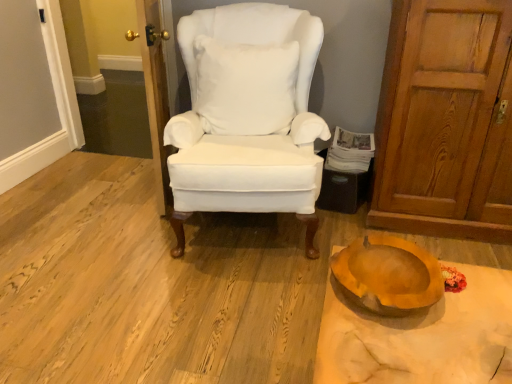
Question: Would you say matte orange bowl at lower right is outside white fabric chair at center?

Choices:
 (A) yes
 (B) no

Answer: (A)

Question: Can you see matte orange bowl at lower right touching white fabric chair at center?

Choices:
 (A) no
 (B) yes

Answer: (A)

Question: Does matte orange bowl at lower right have a greater width compared to white fabric chair at center?

Choices:
 (A) no
 (B) yes

Answer: (A)

Question: Is white fabric chair at center at the back of matte orange bowl at lower right?

Choices:
 (A) yes
 (B) no

Answer: (B)

Question: Considering the relative sizes of matte orange bowl at lower right and white fabric chair at center in the image provided, is matte orange bowl at lower right taller than white fabric chair at center?

Choices:
 (A) no
 (B) yes

Answer: (A)

Question: Can you confirm if matte orange bowl at lower right is smaller than white fabric chair at center?

Choices:
 (A) no
 (B) yes

Answer: (B)

Question: From a real-world perspective, is wooden bowl at lower right below wooden door at right, the second door positioned from the left?

Choices:
 (A) no
 (B) yes

Answer: (B)

Question: Is wooden bowl at lower right not within wooden door at right, the second door positioned from the left?

Choices:
 (A) yes
 (B) no

Answer: (A)

Question: Is wooden bowl at lower right to the left of wooden door at right, the second door positioned from the left, from the viewer's perspective?

Choices:
 (A) yes
 (B) no

Answer: (A)

Question: Is there a large distance between wooden bowl at lower right and wooden door at right, arranged as the first door when viewed from the right?

Choices:
 (A) no
 (B) yes

Answer: (B)

Question: Is wooden bowl at lower right further to the viewer compared to wooden door at right, arranged as the first door when viewed from the right?

Choices:
 (A) yes
 (B) no

Answer: (B)

Question: Can wooden door at right, the second door positioned from the left, be found inside wooden bowl at lower right?

Choices:
 (A) yes
 (B) no

Answer: (B)

Question: Can you confirm if white fluffy pillow at center is positioned to the right of wooden door at left, which is counted as the second door, starting from the right?

Choices:
 (A) yes
 (B) no

Answer: (A)